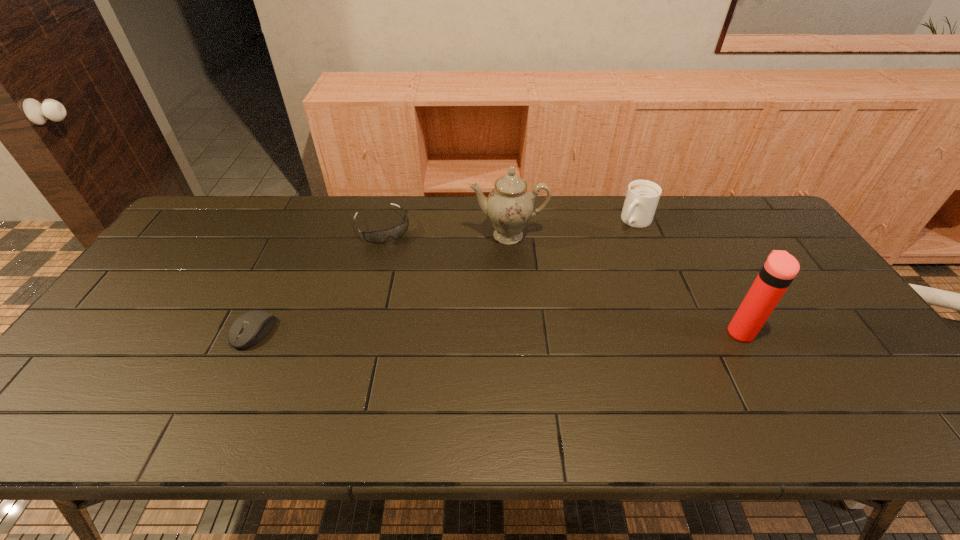
The height and width of the screenshot is (540, 960). Find the location of `goggles that is at the far edge`. goggles that is at the far edge is located at coordinates (374, 236).

Find the location of a particular element. The image size is (960, 540). cappuccino that is at the far edge is located at coordinates (642, 197).

Identify the location of vacant space at the far edge. This screenshot has width=960, height=540. (286, 222).

In the image, there is a desktop. Where is `vacant space at the near edge`? The height and width of the screenshot is (540, 960). vacant space at the near edge is located at coordinates (235, 384).

This screenshot has width=960, height=540. Identify the location of blank space at the left edge of the desktop. (195, 252).

This screenshot has height=540, width=960. What are the coordinates of `vacant space at the right edge of the desktop` in the screenshot? It's located at (826, 349).

Identify the location of free space at the near left corner. The image size is (960, 540). (133, 375).

The width and height of the screenshot is (960, 540). Identify the location of vacant space at the far right corner of the desktop. (761, 216).

Image resolution: width=960 pixels, height=540 pixels. In the image, there is a desktop. What are the coordinates of `vacant area at the near right corner` in the screenshot? It's located at (852, 364).

This screenshot has height=540, width=960. In order to click on free space between the leftmost object and the third object from left to right in this screenshot , I will do `click(381, 284)`.